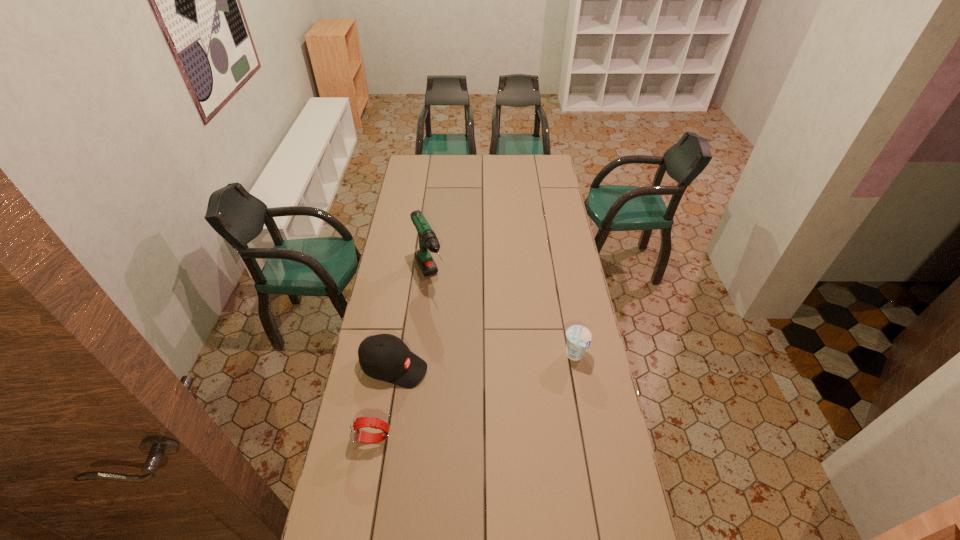
This screenshot has height=540, width=960. In order to click on free spot that satisfies the following two spatial constraints: 1. on the front side of the rightmost object; 2. on the left side of the tallest object in this screenshot , I will do `click(421, 355)`.